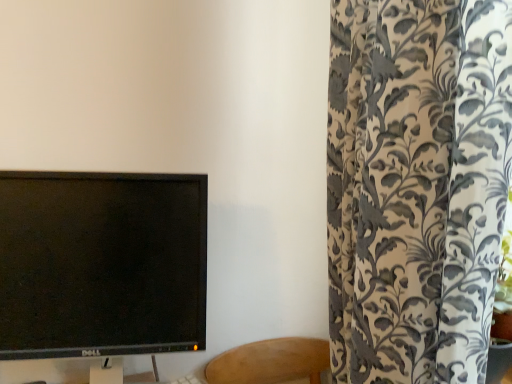
What do you see at coordinates (101, 264) in the screenshot? This screenshot has width=512, height=384. I see `black glossy monitor at left` at bounding box center [101, 264].

Identify the location of black glossy monitor at left. (101, 264).

In order to click on black glossy monitor at left in this screenshot , I will do `click(101, 264)`.